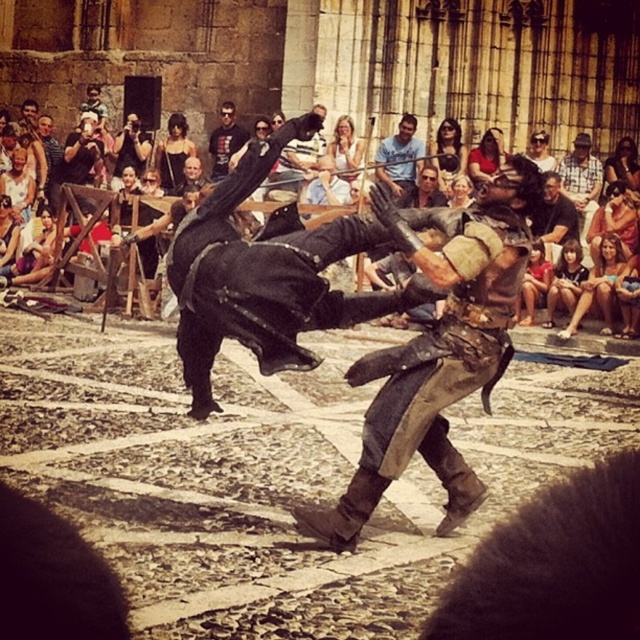
Question: Is matte black clothing at upper center to the left of leather armor at center from the viewer's perspective?

Choices:
 (A) yes
 (B) no

Answer: (A)

Question: Based on their relative distances, which object is nearer to the black leather jacket at upper center?

Choices:
 (A) matte black clothing at upper center
 (B) smooth brown leather jacket at center
 (C) smooth leather jacket at upper right

Answer: (B)

Question: Which point is farther to the camera?

Choices:
 (A) black leather armor at center
 (B) dark brown leather jacket at center
 (C) black leather jacket at upper center
 (D) matte black clothing at upper center

Answer: (C)

Question: Does dark brown leather jacket at center appear on the left side of black leather jacket at upper center?

Choices:
 (A) no
 (B) yes

Answer: (A)

Question: Which point is closer to the camera?

Choices:
 (A) (572, 250)
 (B) (470, 243)
 (C) (566, 240)

Answer: (B)

Question: Is leather armor at center closer to the viewer compared to blue denim shirt at center?

Choices:
 (A) no
 (B) yes

Answer: (B)